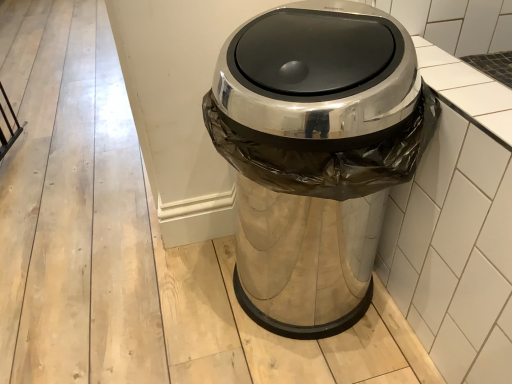
Question: Should I look upward or downward to see polished stainless steel trash can at center?

Choices:
 (A) up
 (B) down

Answer: (B)